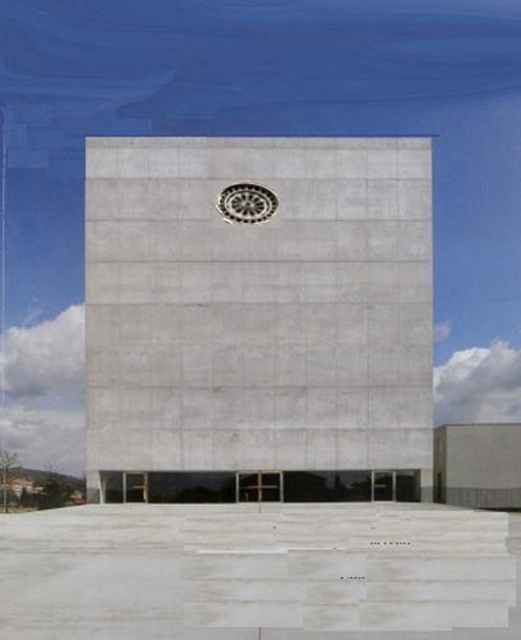
From the picture: You are a city planner reviewing the plaza design. You need to place a new bench in the plaza such that it is equidistant from both the gray concrete tower at center and the black metal clock at center. Is this possible given their sizes?

The gray concrete tower at center is larger in size than the black metal clock at center, so the bench can be placed equidistant from both objects as their sizes do not affect the distance between them.

You are standing in the plaza in front of the gray concrete tower at center and the black metal clock at center. Which object is closer to you?

The gray concrete tower at center is closer to the viewer than the black metal clock at center.

From the picture: You are standing at the point marked as point (x=328, y=483) in front of the modern building. You want to walk directly towards the circular window or vent at the center of the upper facade. How far will you have to walk to reach the base of the building?

The distance between point (x=328, y=483) and the viewer is 55.40 meters. Since you are standing at point (x=328, y=483) and want to reach the base of the building, you will have to walk 55.40 meters.